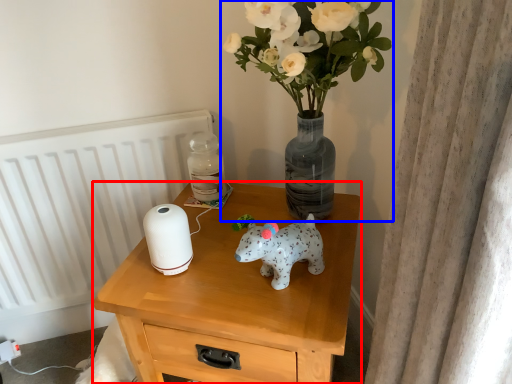
Question: Which object appears farthest to the camera in this image, nightstand (highlighted by a red box) or houseplant (highlighted by a blue box)?

Choices:
 (A) nightstand
 (B) houseplant

Answer: (A)